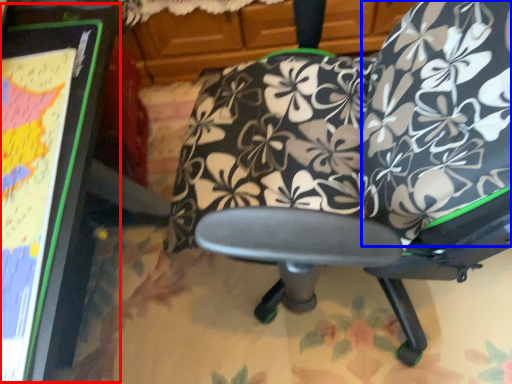
Question: Which object is further to the camera taking this photo, bulletin board (highlighted by a red box) or bean bag chair (highlighted by a blue box)?

Choices:
 (A) bulletin board
 (B) bean bag chair

Answer: (B)